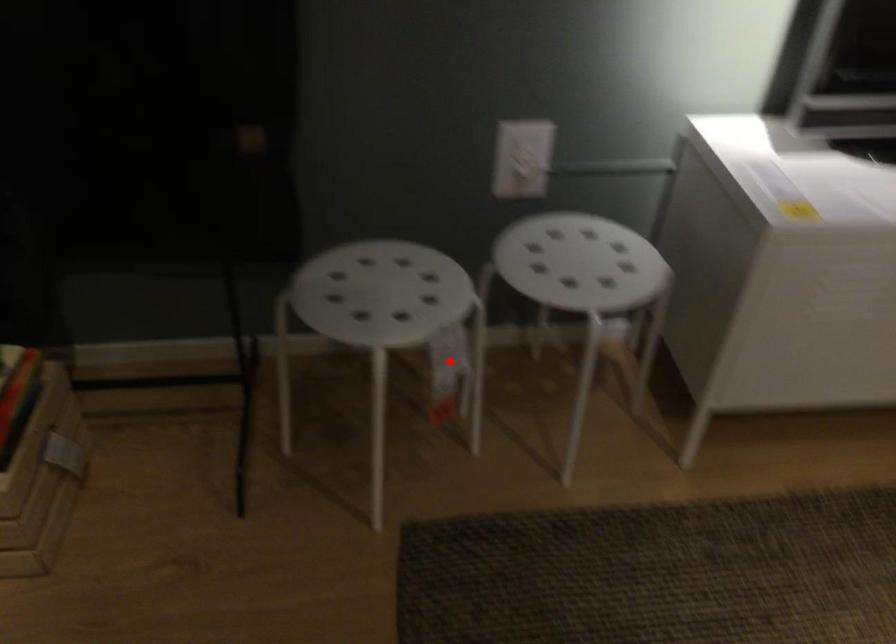
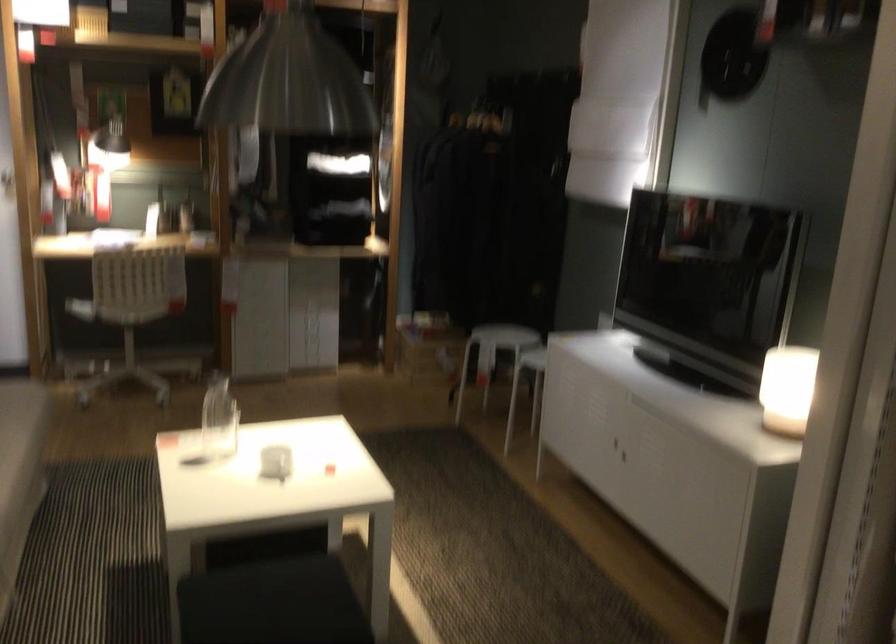
Question: A red point is marked in image1. In image2, is the corresponding 3D point closer to the camera or farther? Reply with the corresponding letter.

Choices:
 (A) The corresponding 3D point is closer.
 (B) The corresponding 3D point is farther.

Answer: (B)